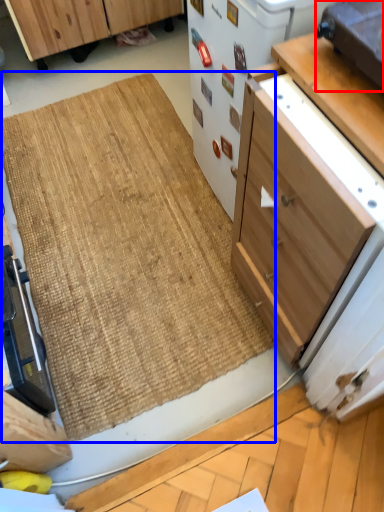
Question: Which object appears farthest to the camera in this image, appliance (highlighted by a red box) or doormat (highlighted by a blue box)?

Choices:
 (A) appliance
 (B) doormat

Answer: (B)